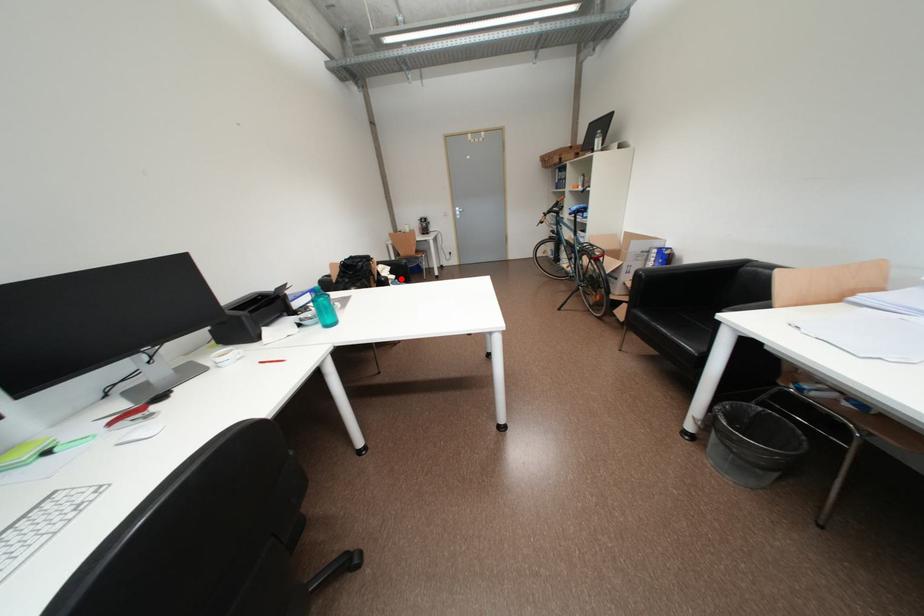
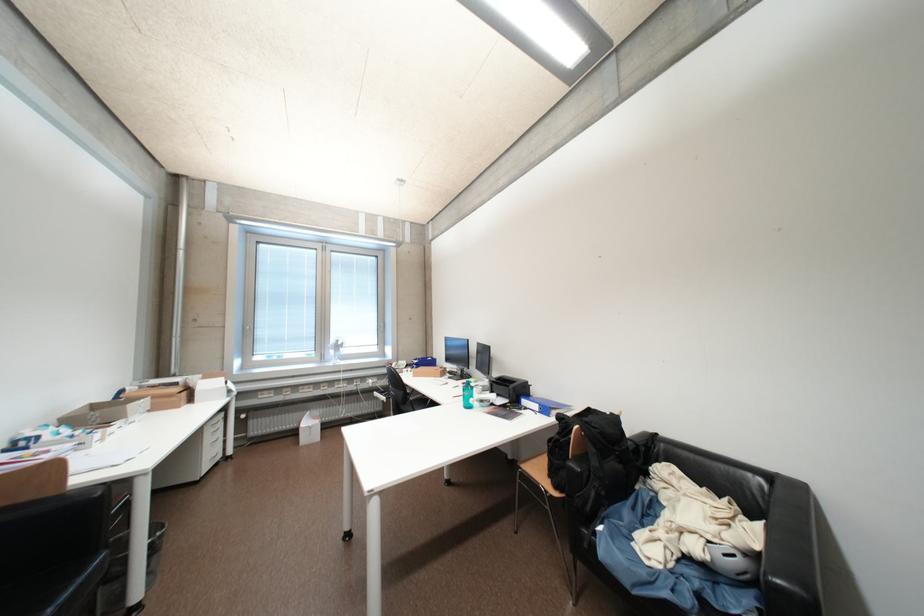
Question: I am providing you with two images of the same scene from different viewpoints. Given a red point in image1, look at the same physical point in image2. Is it:

Choices:
 (A) Closer to the viewpoint
 (B) Farther from the viewpoint

Answer: (B)